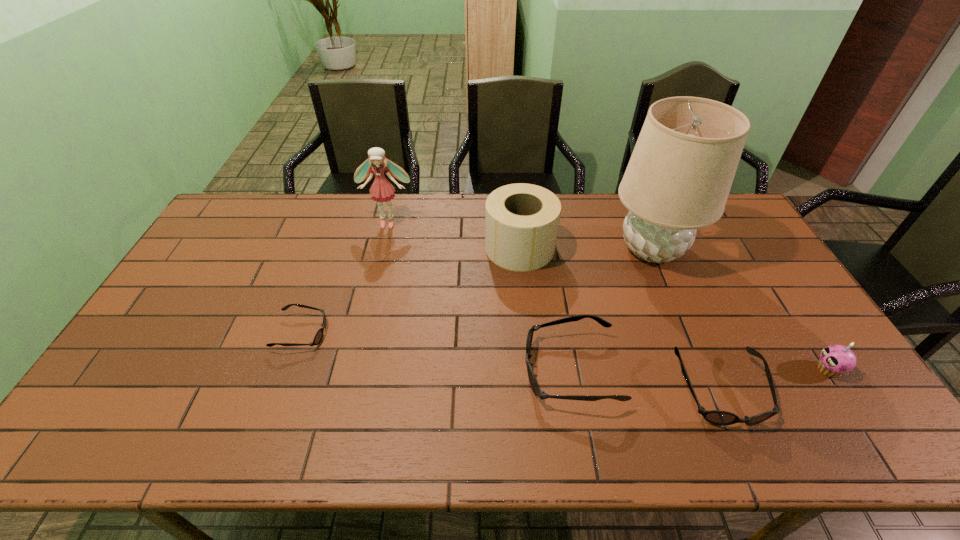
You are a GUI agent. You are given a task and a screenshot of the screen. Output one action in this format:
    pyautogui.click(x=<x>, y=<y>)
    Task: Click on the vacant space that satisfies the following two spatial constraints: 1. on the front-facing side of the doll; 2. on the left side of the tallest object
    Image resolution: width=960 pixels, height=540 pixels.
    Given the screenshot: What is the action you would take?
    pyautogui.click(x=382, y=249)

Find the location of a particular element. The image size is (960, 540). vacant space that satisfies the following two spatial constraints: 1. on the front-facing side of the tallest object; 2. on the right side of the doll is located at coordinates (382, 249).